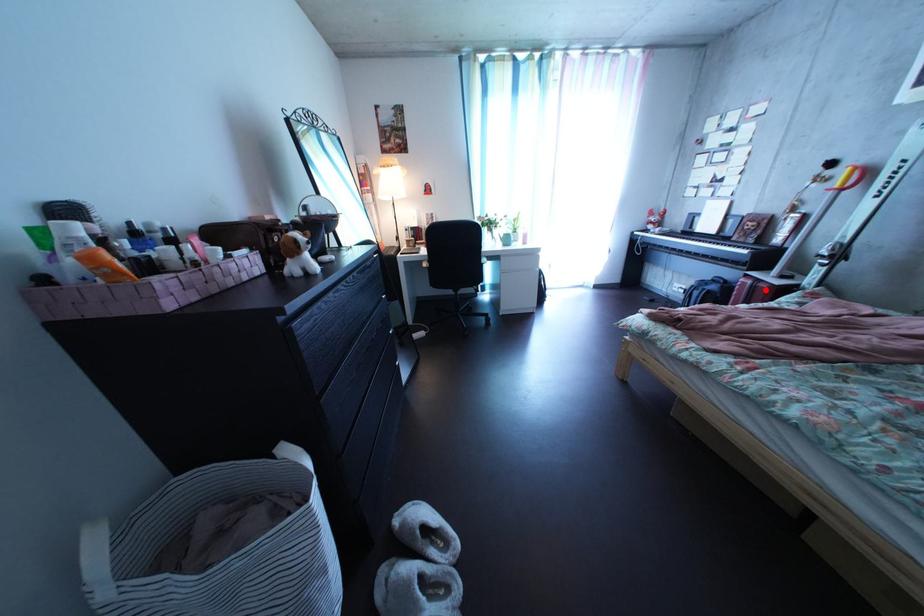
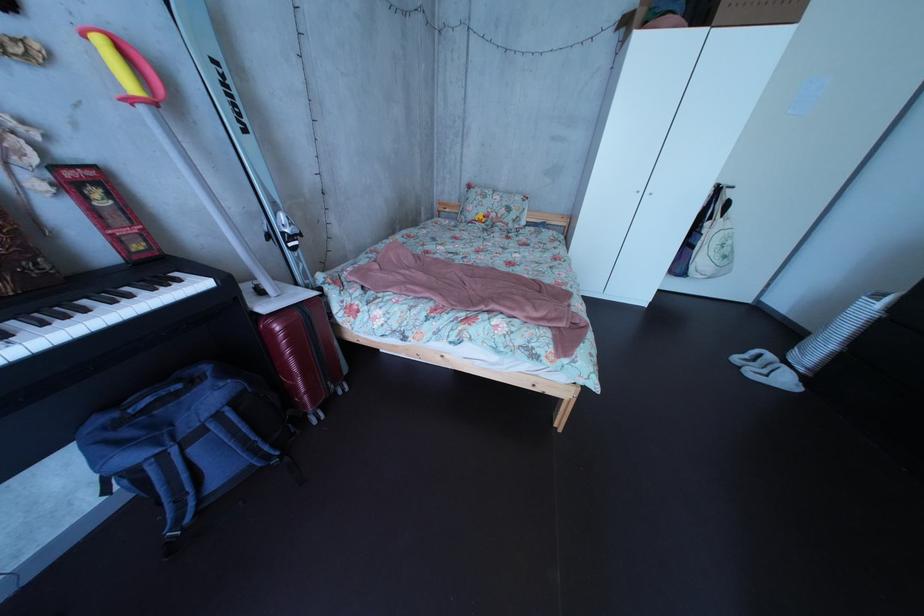
Question: A red point is marked in image1. In image2, is the corresponding 3D point closer to the camera or farther? Reply with the corresponding letter.

Choices:
 (A) The corresponding 3D point is closer.
 (B) The corresponding 3D point is farther.

Answer: (A)